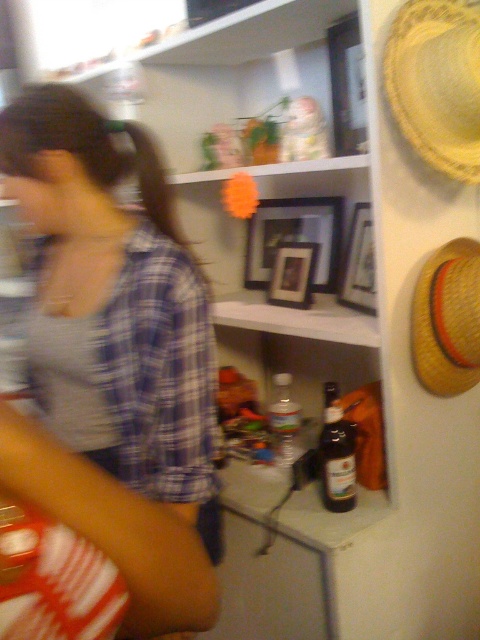
You are organizing items on the shelves in the pantry. You have two yellow straw hats to place. One is a yellow woven straw hat at upper right and the other is a yellow straw hat at right. According to the image, which yellow straw hat is located more to the left?

The yellow woven straw hat at upper right is positioned on the left side of the yellow straw hat at right, so the yellow woven straw hat at upper right is more to the left.

You are trying to decide which item to grab first between the blue plaid shirt at center and the yellow woven straw hat at upper right based on their sizes. Which one is wider?

The blue plaid shirt at center is wider than the yellow woven straw hat at upper right according to the description.